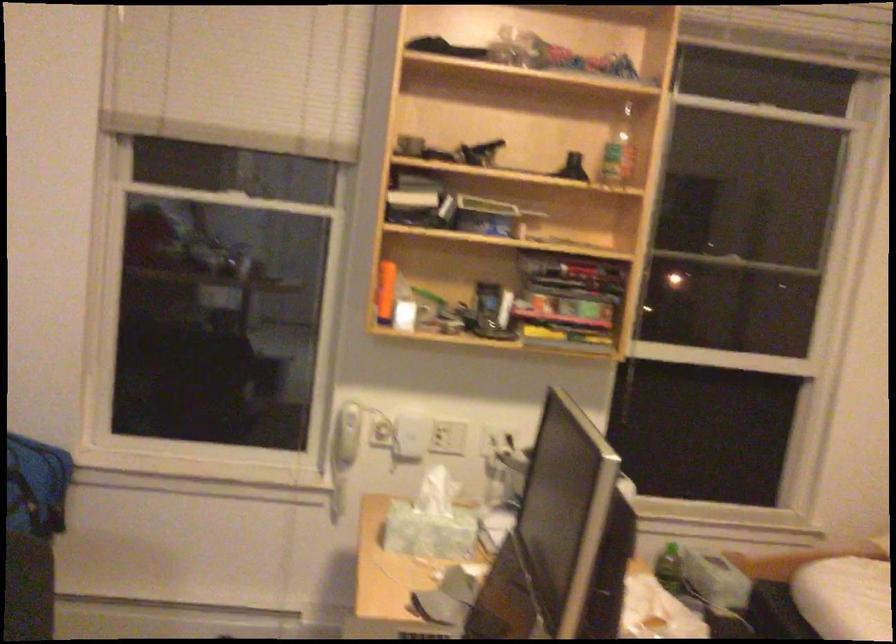
The image size is (896, 644). What do you see at coordinates (489, 313) in the screenshot?
I see `the black phone handset` at bounding box center [489, 313].